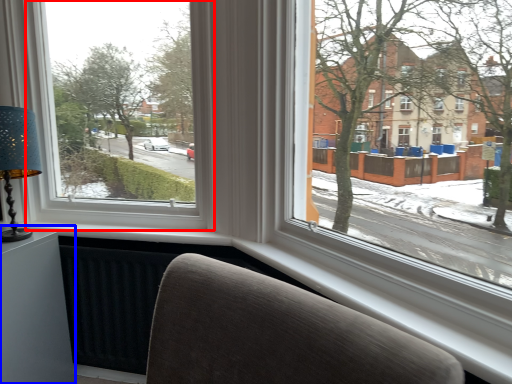
Question: Which point is closer to the camera, window (highlighted by a red box) or table (highlighted by a blue box)?

Choices:
 (A) window
 (B) table

Answer: (A)